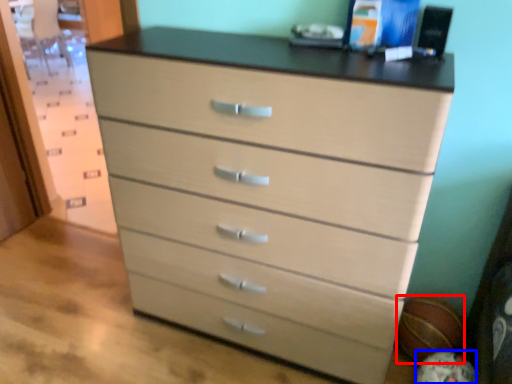
Question: Among these objects, which one is nearest to the camera, basketball (highlighted by a red box) or basketball (highlighted by a blue box)?

Choices:
 (A) basketball
 (B) basketball

Answer: (B)